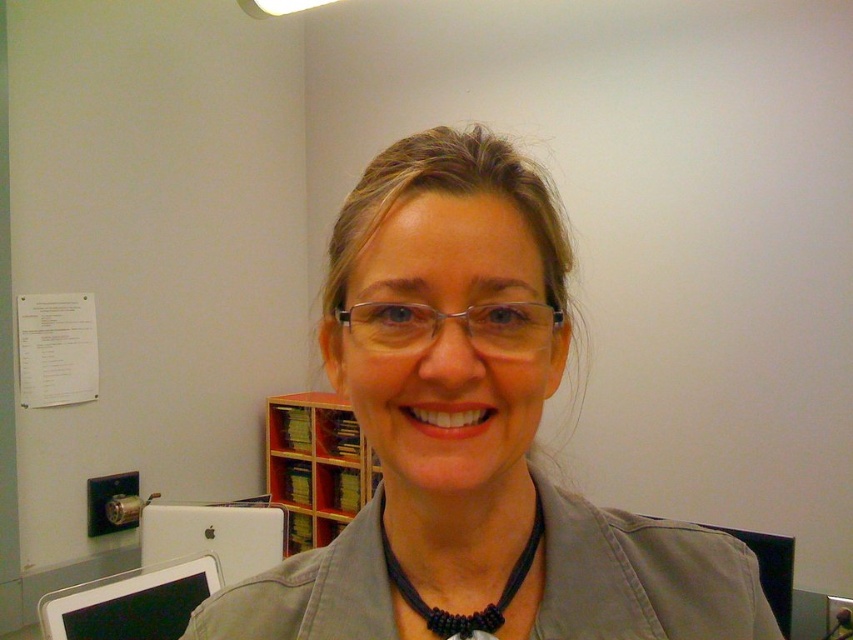
You are a photographer adjusting your camera settings to focus on the black beaded necklace at center and the wooden bookshelf at center. Which object is closer to the camera?

The black beaded necklace at center is behind the wooden bookshelf at center, so the wooden bookshelf at center is closer to the camera.

You are a tailor who needs to measure the distance between the matte gray jacket at center and the black beaded necklace at center for a custom fit. Can you determine which one is closer to the camera?

The matte gray jacket at center is in front of the black beaded necklace at center, so the matte gray jacket at center is closer to the camera.